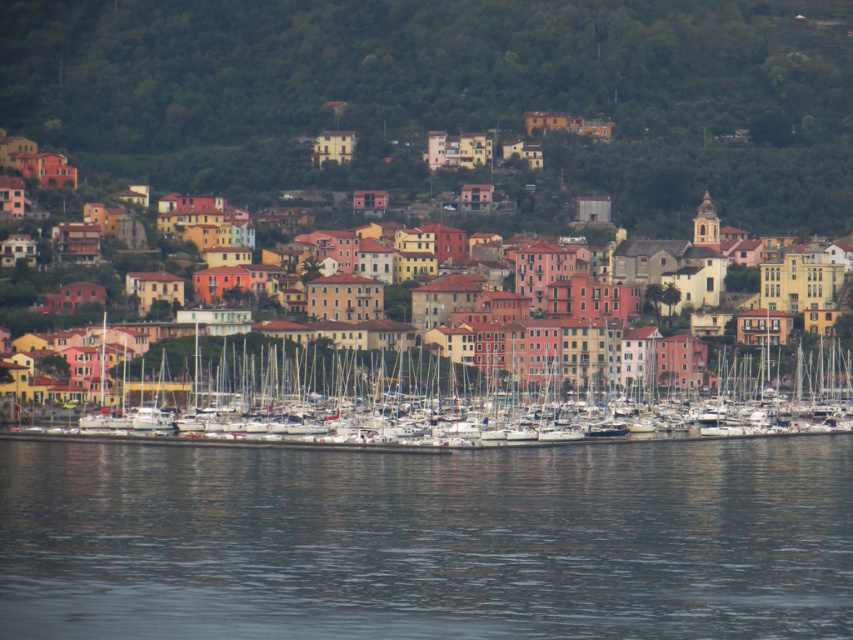
You are standing at the edge of the marina looking towards the town. Which object is positioned lower in the scene, the dark gray water at lower center or the multicolored buildings at center?

The dark gray water at lower center is positioned below the multicolored buildings at center, so it is lower in the scene.

You are standing at the point with coordinates (x=428, y=540) in the coastal town scene. What do you see at that exact location?

At point (x=428, y=540), you see dark gray water at lower center.